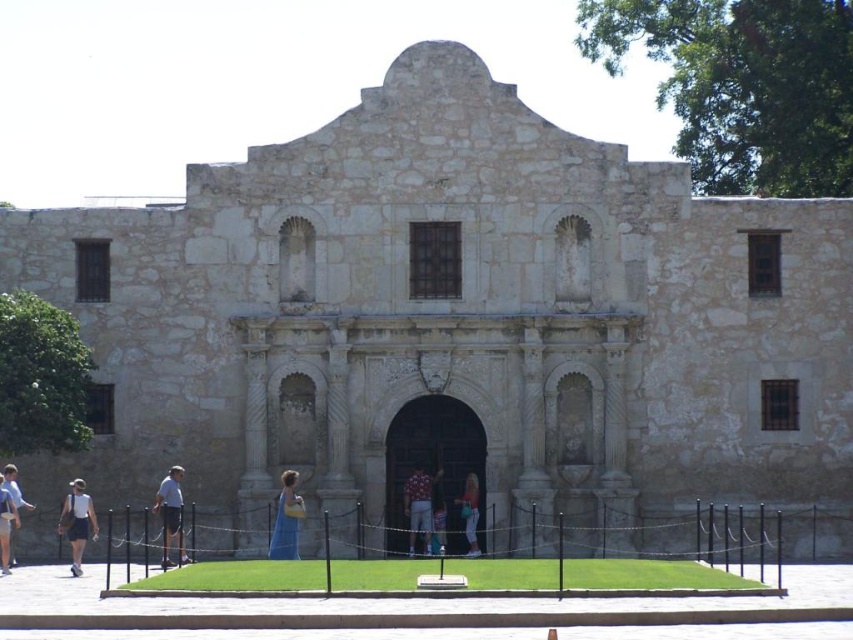
Who is positioned more to the left, matte white dress at lower left or light blue dress at center?

matte white dress at lower left is more to the left.

Between point (3, 470) and point (431, 548), which one is positioned in front?

Point (3, 470)

Is point (16, 493) positioned behind point (434, 536)?

No.

What are the coordinates of `matte white dress at lower left` in the screenshot? It's located at (15, 488).

Is white cotton shorts at lower left in front of matte blue dress at center?

No, white cotton shorts at lower left is behind matte blue dress at center.

Is point (74, 483) behind point (293, 541)?

Yes.

Where is `white cotton shorts at lower left`? white cotton shorts at lower left is located at coordinates (77, 522).

Measure the distance from white cotton shorts at lower left to light blue denim shorts at lower left.

A distance of 11.58 feet exists between white cotton shorts at lower left and light blue denim shorts at lower left.

Between point (57, 528) and point (180, 499), which one is positioned in front?

Point (180, 499) is more forward.

Between point (74, 500) and point (183, 557), which one is positioned in front?

Point (74, 500)

Image resolution: width=853 pixels, height=640 pixels. I want to click on white cotton shorts at lower left, so click(77, 522).